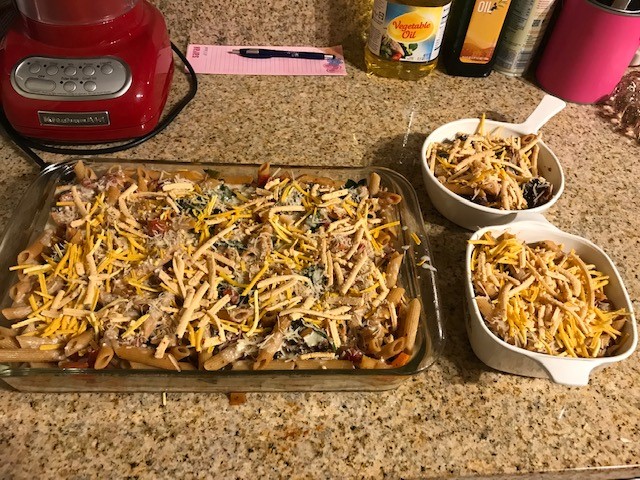
You are a GUI agent. You are given a task and a screenshot of the screen. Output one action in this format:
    pyautogui.click(x=<x>, y=<y>)
    Task: Click on the electrical cable
    
    Given the screenshot: What is the action you would take?
    pyautogui.click(x=178, y=102)